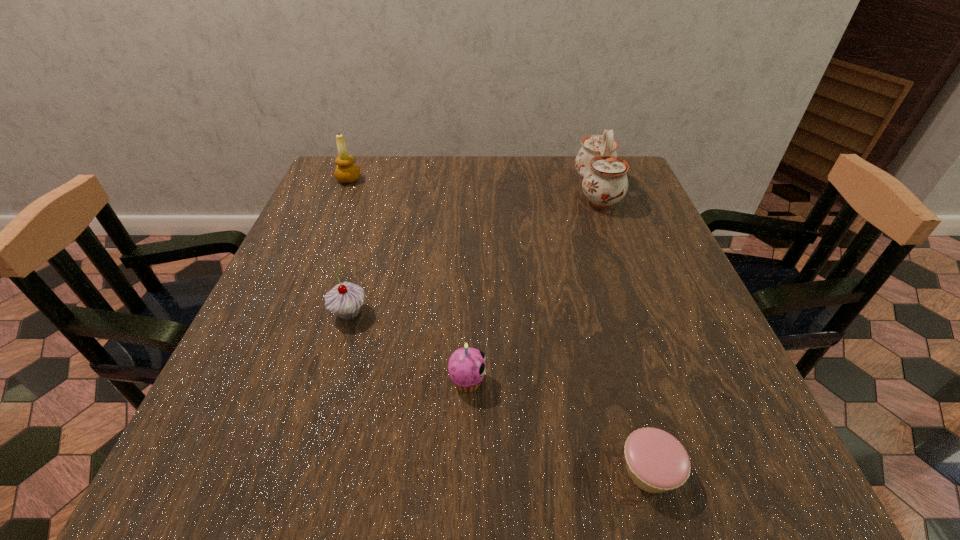
At what (x,y) coordinates should I click in order to perform the action: click on vacant region located by the handle of the chinaware. Please return your answer as a coordinate pair (x, y). Looking at the image, I should click on (443, 191).

I want to click on blank space located 0.350m on the front of the candle_holder, so click(310, 272).

At what (x,y) coordinates should I click in order to perform the action: click on free space located on the right of the fourth object from right to left. Please return your answer as a coordinate pair (x, y). The height and width of the screenshot is (540, 960). Looking at the image, I should click on (429, 313).

Find the location of `vacant region located 0.310m on the face of the second nearest cupcake`. vacant region located 0.310m on the face of the second nearest cupcake is located at coordinates (667, 381).

At what (x,y) coordinates should I click in order to perform the action: click on free space located on the left of the shortest object. Please return your answer as a coordinate pair (x, y). The image size is (960, 540). Looking at the image, I should click on (509, 471).

In order to click on chinaware situated at the far edge in this screenshot , I will do `click(605, 182)`.

Find the location of `candle_holder that is at the far edge`. candle_holder that is at the far edge is located at coordinates (346, 172).

Identify the location of object at the near edge. The height and width of the screenshot is (540, 960). (656, 461).

You are a GUI agent. You are given a task and a screenshot of the screen. Output one action in this format:
    pyautogui.click(x=<x>, y=<y>)
    Task: Click on the candle_holder located at the left edge
    The image size is (960, 540).
    Given the screenshot: What is the action you would take?
    pyautogui.click(x=346, y=172)

I want to click on cupcake that is at the left edge, so tap(345, 299).